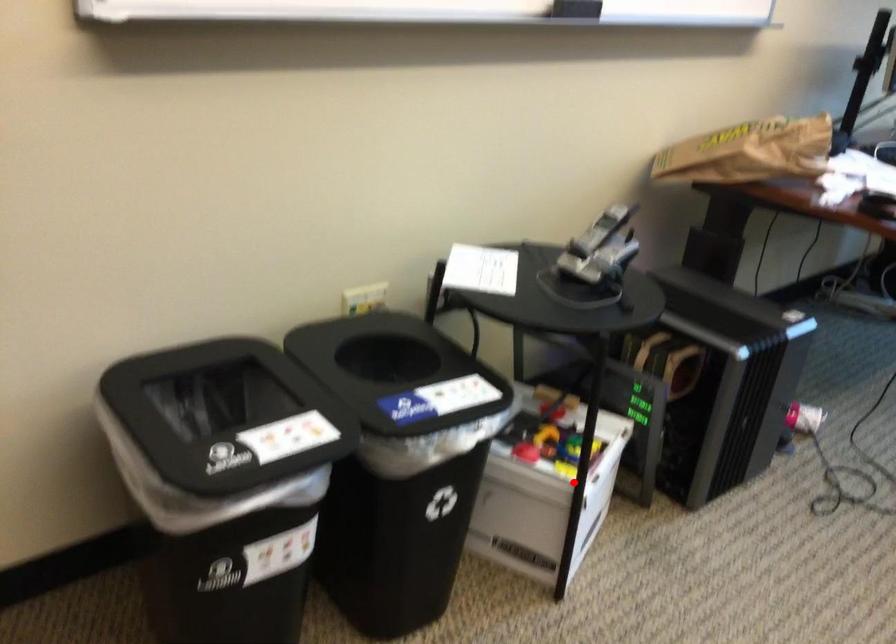
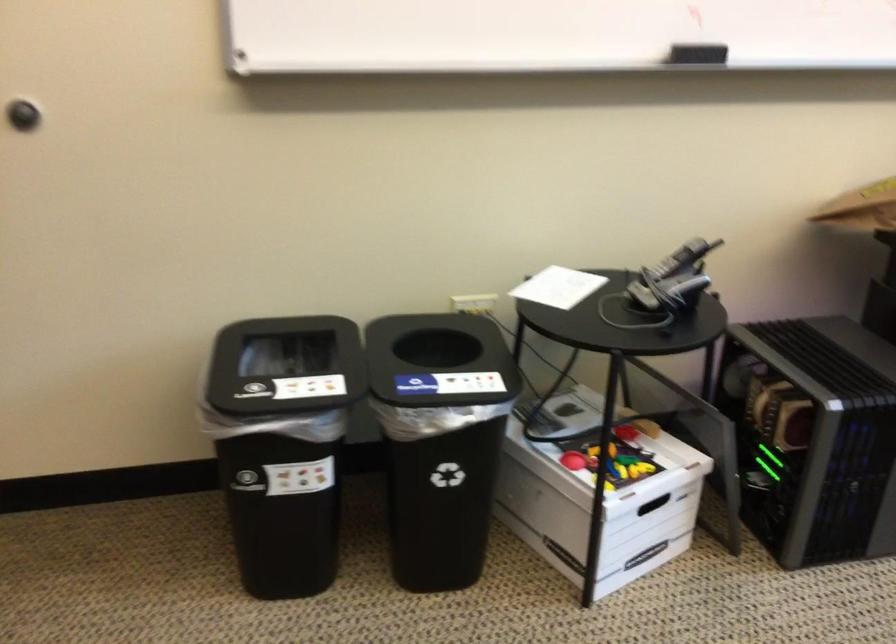
The point at the highlighted location is marked in the first image. Where is the corresponding point in the second image?

(599, 495)